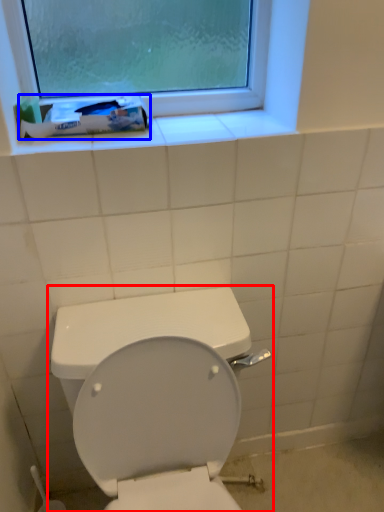
Question: Among these objects, which one is nearest to the camera, toilet (highlighted by a red box) or toothpaste (highlighted by a blue box)?

Choices:
 (A) toilet
 (B) toothpaste

Answer: (A)